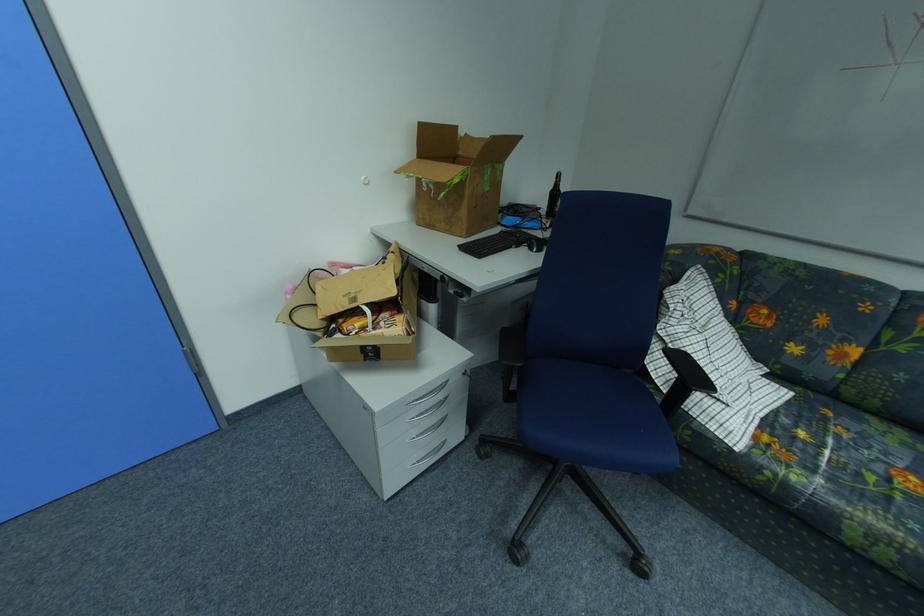
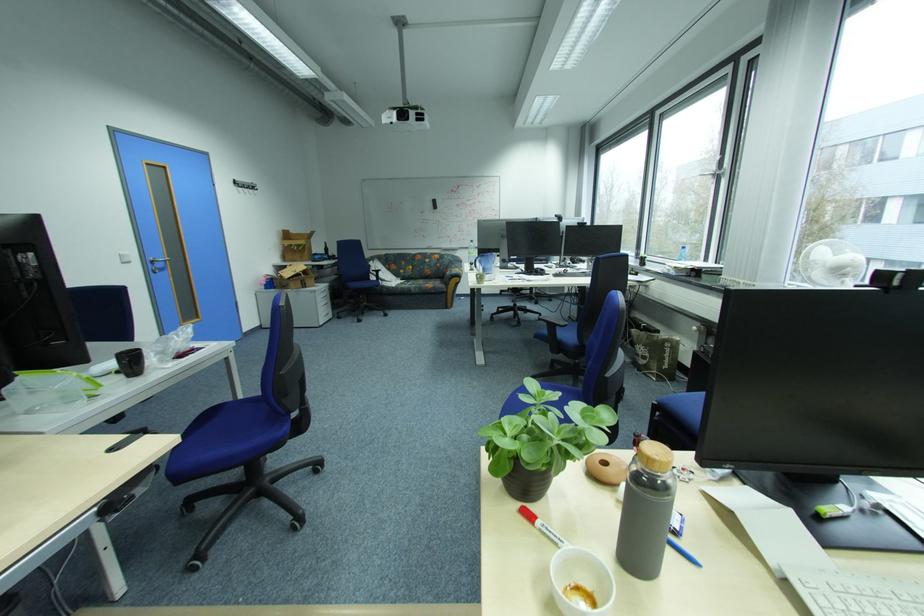
Locate, in the second image, the point that corresponds to point 804,479 in the first image.

(411, 286)